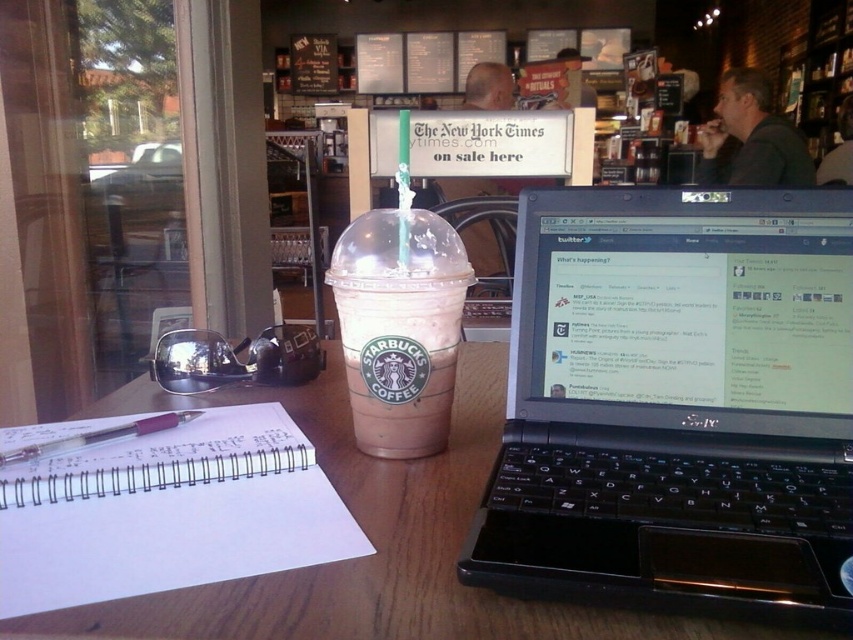
Is wooden table at center thinner than translucent plastic pen at lower left?

No.

Based on the photo, is wooden table at center shorter than translucent plastic pen at lower left?

No.

Who is more forward, (492, 598) or (120, 429)?

A: Positioned in front is point (492, 598).

The height and width of the screenshot is (640, 853). Find the location of `wooden table at center`. wooden table at center is located at coordinates pos(375,541).

Who is lower down, black plastic laptop at center or white spiral notebook at center?

white spiral notebook at center is lower down.

Locate an element on the screen. black plastic laptop at center is located at coordinates (677, 403).

Who is positioned more to the left, black plastic laptop at center or pink frosted cup at center?

pink frosted cup at center

Can you confirm if black plastic laptop at center is positioned above pink frosted cup at center?

No.

From the picture: Who is more distant from viewer, (566, 346) or (403, 227)?

Point (566, 346)

You are a GUI agent. You are given a task and a screenshot of the screen. Output one action in this format:
    pyautogui.click(x=<x>, y=<y>)
    Task: Click on the black plastic laptop at center
    
    Given the screenshot: What is the action you would take?
    coord(677,403)